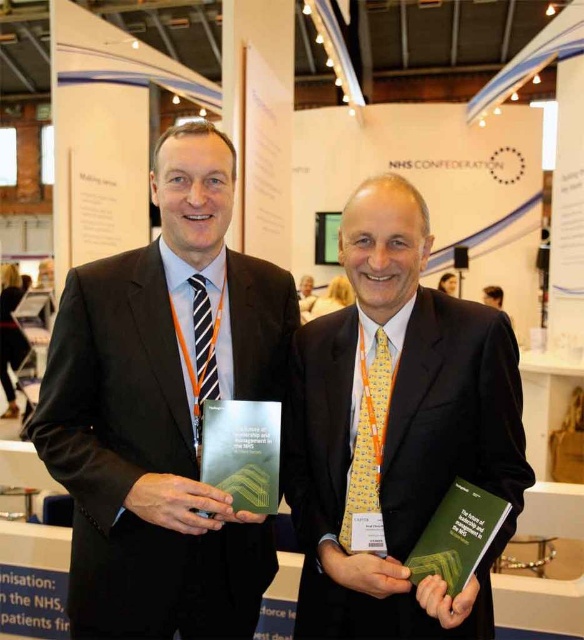
You are standing at the origin point in the conference hall. Where is the dark brown suit at center located in terms of coordinates?

The dark brown suit at center is located at coordinates point (164, 410).